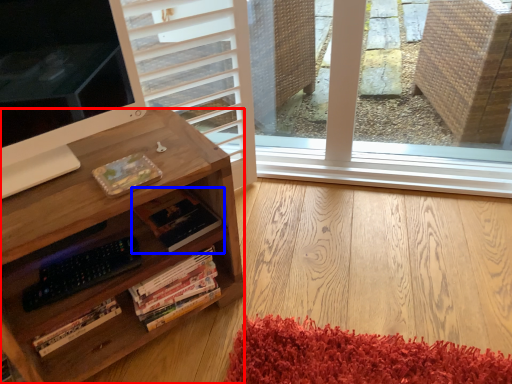
Question: Which object is further to the camera taking this photo, desk (highlighted by a red box) or book (highlighted by a blue box)?

Choices:
 (A) desk
 (B) book

Answer: (B)